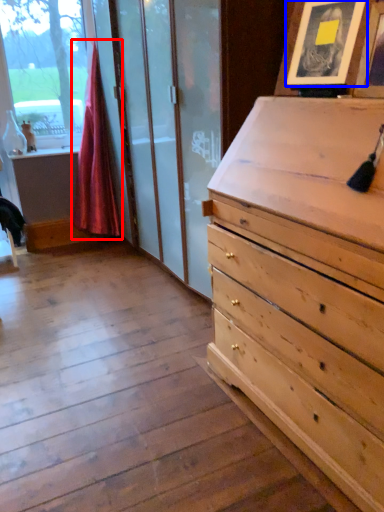
Question: Among these objects, which one is nearest to the camera, curtain (highlighted by a red box) or picture frame (highlighted by a blue box)?

Choices:
 (A) curtain
 (B) picture frame

Answer: (B)